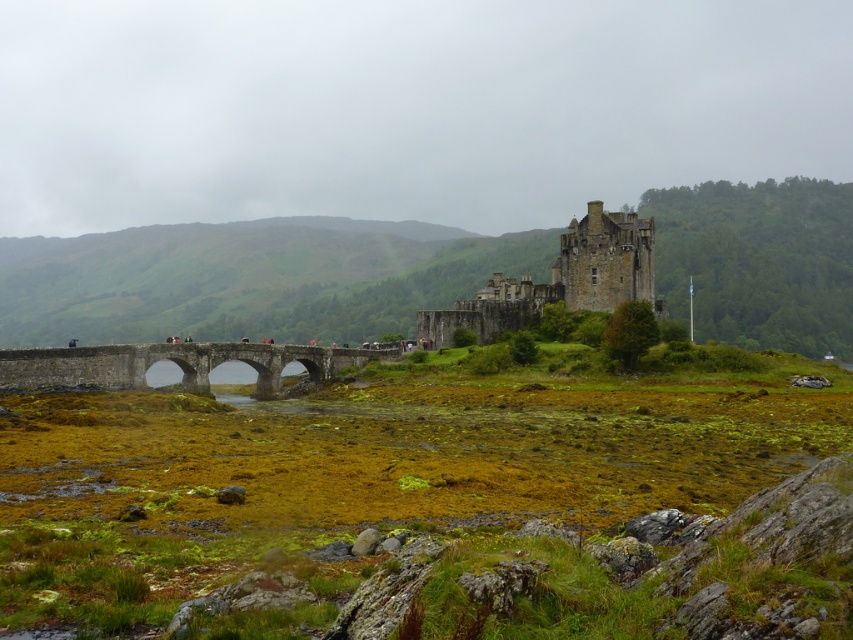
Question: Which of the following is the closest to the observer?

Choices:
 (A) stone bridge at center
 (B) stone medieval castle at center

Answer: (A)

Question: Does stone medieval castle at center appear over stone bridge at center?

Choices:
 (A) yes
 (B) no

Answer: (A)

Question: Is stone medieval castle at center in front of stone bridge at center?

Choices:
 (A) no
 (B) yes

Answer: (A)

Question: Can you confirm if stone medieval castle at center is positioned above stone bridge at center?

Choices:
 (A) yes
 (B) no

Answer: (A)